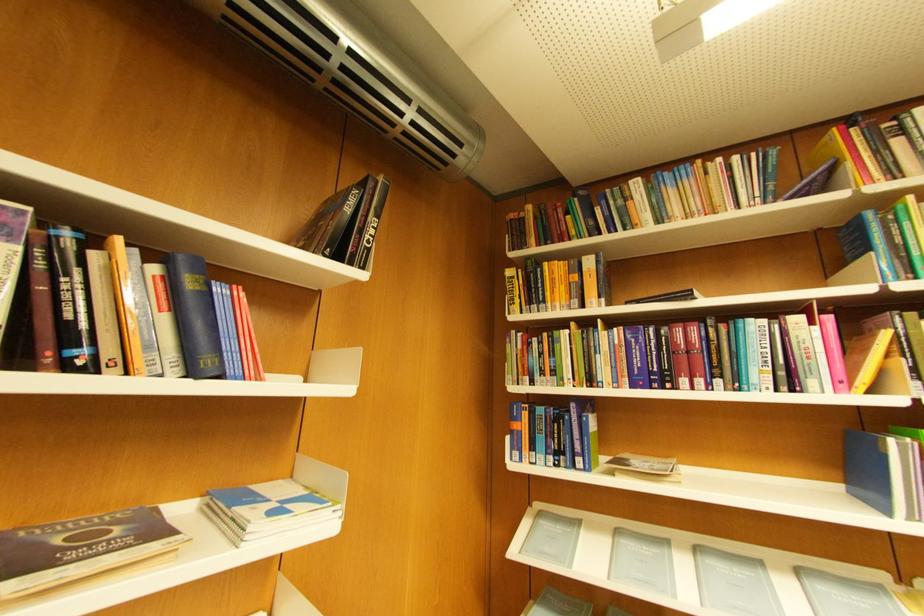
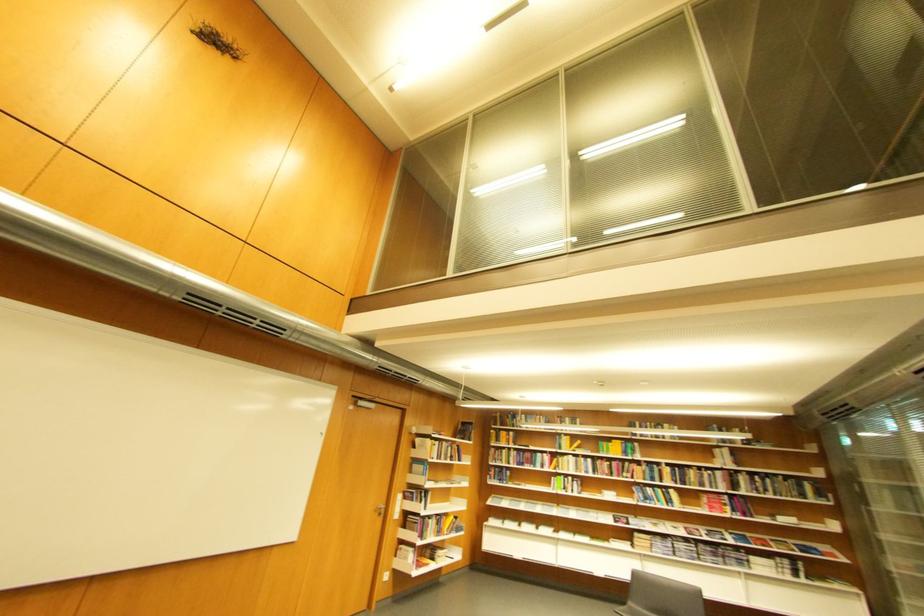
Question: I am providing you with two images of the same scene from different viewpoints. Please identify which objects are invisible in image2.

Choices:
 (A) bookshelf book
 (B) grey chair sitting surface
 (C) silver door handle
 (D) none of these

Answer: (D)